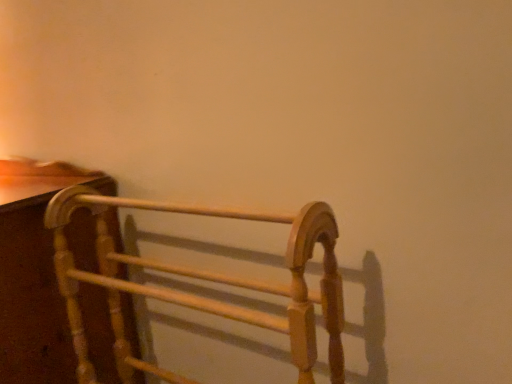
Question: From a real-world perspective, is wooden towel rack at left, arranged as the 1th furniture when viewed from the left, physically below light brown wood towel rack at left, positioned as the first furniture in right-to-left order?

Choices:
 (A) yes
 (B) no

Answer: (A)

Question: Would you say wooden towel rack at left, arranged as the 1th furniture when viewed from the left, contains light brown wood towel rack at left, which is the 2th furniture in left-to-right order?

Choices:
 (A) no
 (B) yes

Answer: (A)

Question: Considering the relative positions of wooden towel rack at left, placed as the second furniture when sorted from right to left, and light brown wood towel rack at left, which is the 2th furniture in left-to-right order, in the image provided, is wooden towel rack at left, placed as the second furniture when sorted from right to left, to the left of light brown wood towel rack at left, which is the 2th furniture in left-to-right order, from the viewer's perspective?

Choices:
 (A) yes
 (B) no

Answer: (A)

Question: Considering the relative sizes of wooden towel rack at left, arranged as the 1th furniture when viewed from the left, and light brown wood towel rack at left, which is the 2th furniture in left-to-right order, in the image provided, is wooden towel rack at left, arranged as the 1th furniture when viewed from the left, wider than light brown wood towel rack at left, which is the 2th furniture in left-to-right order,?

Choices:
 (A) yes
 (B) no

Answer: (A)

Question: Is the surface of wooden towel rack at left, arranged as the 1th furniture when viewed from the left, in direct contact with light brown wood towel rack at left, which is the 2th furniture in left-to-right order?

Choices:
 (A) no
 (B) yes

Answer: (A)

Question: Is wooden towel rack at left, arranged as the 1th furniture when viewed from the left, located outside light brown wood towel rack at left, positioned as the first furniture in right-to-left order?

Choices:
 (A) yes
 (B) no

Answer: (A)

Question: Can you confirm if light brown wood towel rack at left, which is the 2th furniture in left-to-right order, is shorter than wooden towel rack at left, placed as the second furniture when sorted from right to left?

Choices:
 (A) yes
 (B) no

Answer: (A)

Question: Considering the relative positions of light brown wood towel rack at left, positioned as the first furniture in right-to-left order, and wooden towel rack at left, placed as the second furniture when sorted from right to left, in the image provided, is light brown wood towel rack at left, positioned as the first furniture in right-to-left order, behind wooden towel rack at left, placed as the second furniture when sorted from right to left,?

Choices:
 (A) yes
 (B) no

Answer: (B)

Question: Does light brown wood towel rack at left, positioned as the first furniture in right-to-left order, have a greater height compared to wooden towel rack at left, placed as the second furniture when sorted from right to left?

Choices:
 (A) yes
 (B) no

Answer: (B)

Question: Are light brown wood towel rack at left, which is the 2th furniture in left-to-right order, and wooden towel rack at left, arranged as the 1th furniture when viewed from the left, making contact?

Choices:
 (A) yes
 (B) no

Answer: (B)

Question: Are light brown wood towel rack at left, which is the 2th furniture in left-to-right order, and wooden towel rack at left, placed as the second furniture when sorted from right to left, located far from each other?

Choices:
 (A) no
 (B) yes

Answer: (A)

Question: Does light brown wood towel rack at left, which is the 2th furniture in left-to-right order, lie in front of wooden towel rack at left, arranged as the 1th furniture when viewed from the left?

Choices:
 (A) yes
 (B) no

Answer: (A)

Question: Considering the positions of light brown wood towel rack at left, positioned as the first furniture in right-to-left order, and wooden towel rack at left, placed as the second furniture when sorted from right to left, in the image, is light brown wood towel rack at left, positioned as the first furniture in right-to-left order, bigger or smaller than wooden towel rack at left, placed as the second furniture when sorted from right to left,?

Choices:
 (A) small
 (B) big

Answer: (A)